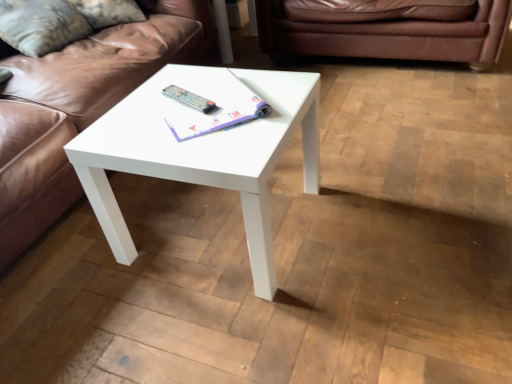
Question: Is brown leather couch at center, which appears as the 1th studio couch when viewed from the right, taller or shorter than silver metallic remote at center?

Choices:
 (A) short
 (B) tall

Answer: (B)

Question: Based on their positions, is brown leather couch at center, which ranks as the 2th studio couch in left-to-right order, located to the left or right of silver metallic remote at center?

Choices:
 (A) right
 (B) left

Answer: (A)

Question: Estimate the real-world distances between objects in this image. Which object is farther from the white paper book at center?

Choices:
 (A) velvet floral pillow at upper left
 (B) silver metallic remote at center
 (C) brown leather couch at upper left, arranged as the 1th studio couch when viewed from the left
 (D) brown leather couch at center, which appears as the 1th studio couch when viewed from the right
 (E) white glossy coffee table at center

Answer: (D)

Question: Which is farther from the white paper book at center?

Choices:
 (A) brown leather couch at upper left, arranged as the 1th studio couch when viewed from the left
 (B) silver metallic remote at center
 (C) brown leather couch at center, which appears as the 1th studio couch when viewed from the right
 (D) velvet floral pillow at upper left
 (E) white glossy coffee table at center

Answer: (C)